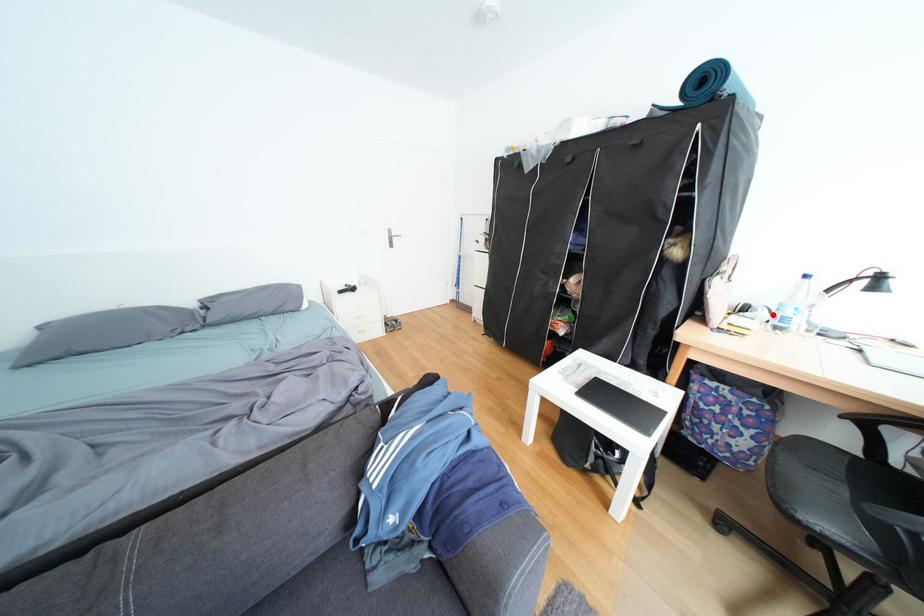
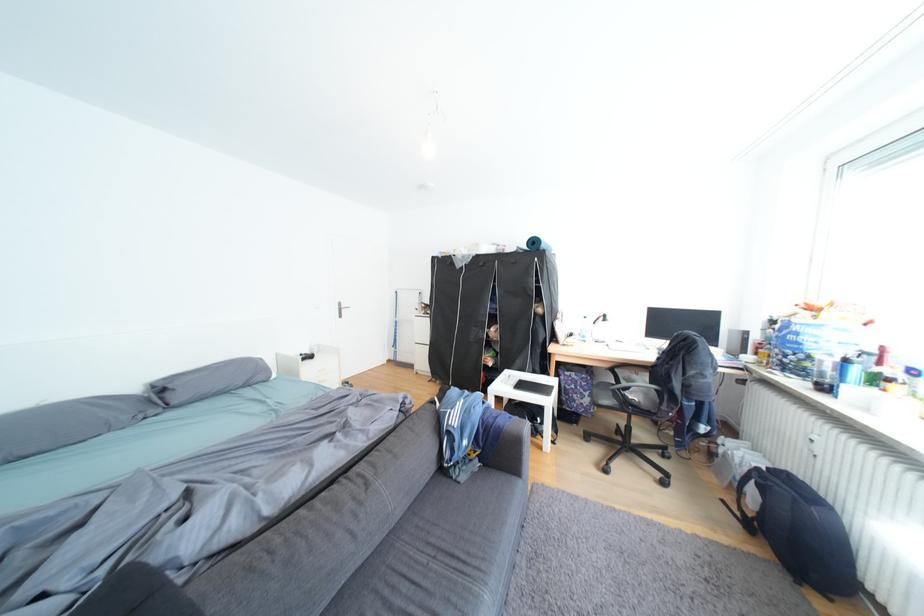
The point at the highlighted location is marked in the first image. Where is the corresponding point in the second image?

(590, 337)